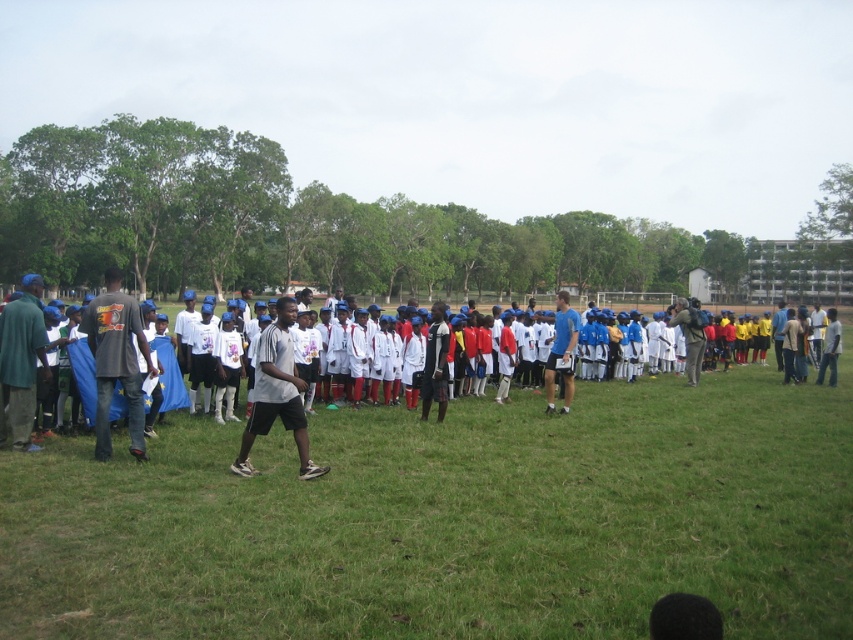
You are standing in the middle of the grassy field and see the green grass at center and the white matte shorts at center. Which object is positioned to the right of the other?

The green grass at center is to the right of white matte shorts at center.

You are organizing a picnic and need to place a picnic basket on the green grass at center. However, there is a black matte shirt at left nearby. Which area has more space to place the basket without overlapping the shirt?

The green grass at center has more space since its width surpasses that of the black matte shirt at left.